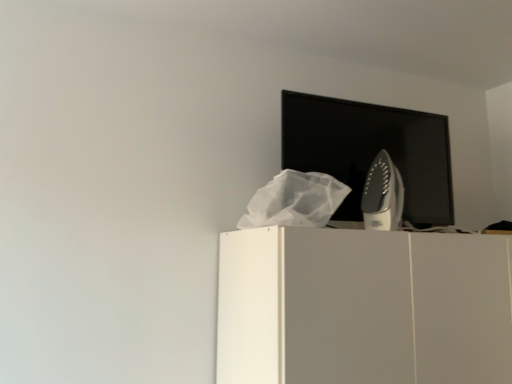
Question: From a real-world perspective, relative to black glossy computer monitor at upper center, is satin silver iron at upper right vertically above or below?

Choices:
 (A) below
 (B) above

Answer: (A)

Question: Does point (394, 187) appear closer or farther from the camera than point (438, 180)?

Choices:
 (A) farther
 (B) closer

Answer: (B)

Question: Estimate the real-world distances between objects in this image. Which object is closer to the satin silver iron at upper right?

Choices:
 (A) black glossy computer monitor at upper center
 (B) white matte cabinet at upper center

Answer: (A)

Question: Which object is the farthest from the black glossy computer monitor at upper center?

Choices:
 (A) satin silver iron at upper right
 (B) white matte cabinet at upper center

Answer: (B)